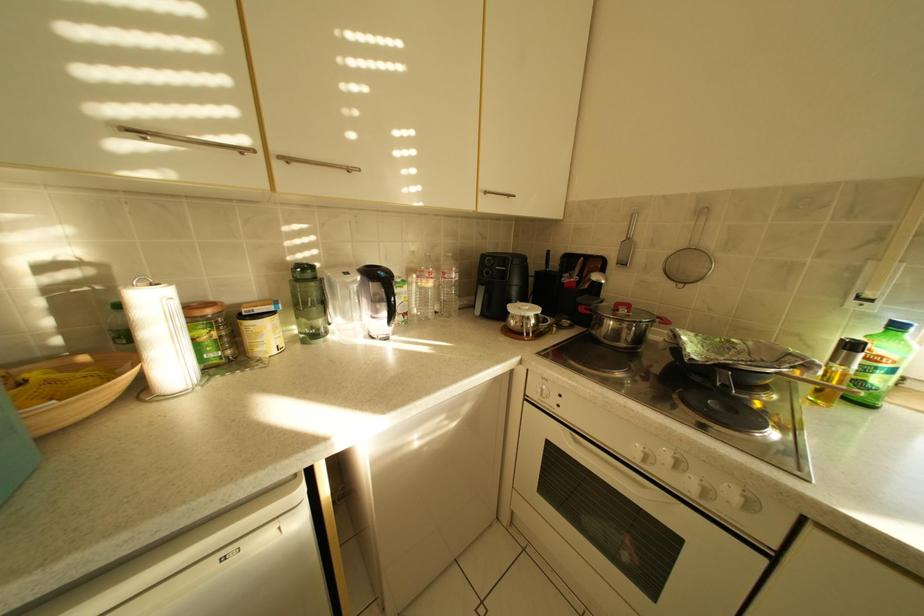
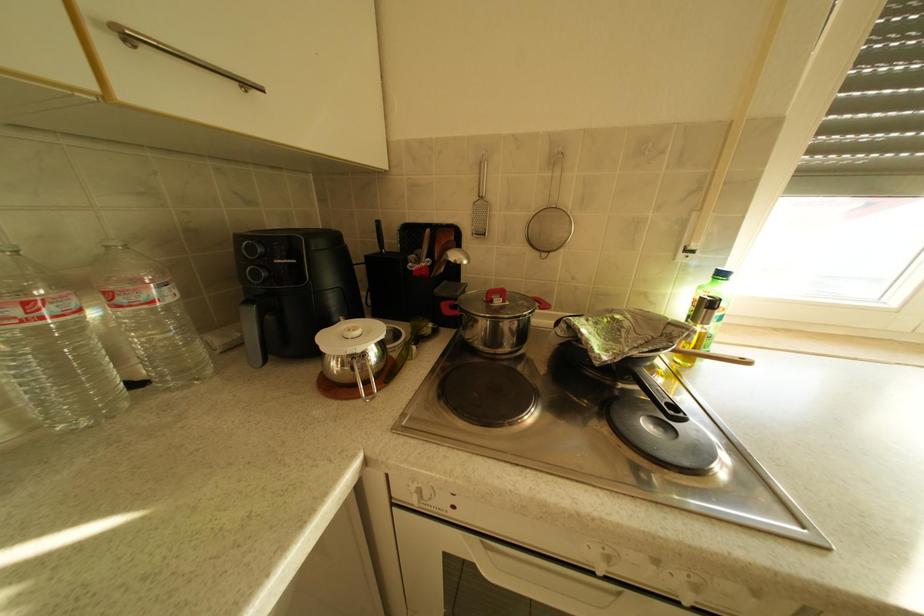
Question: The images are taken continuously from a first-person perspective. In which direction is your viewpoint rotating?

Choices:
 (A) Left
 (B) Right
 (C) Up
 (D) Down

Answer: (B)